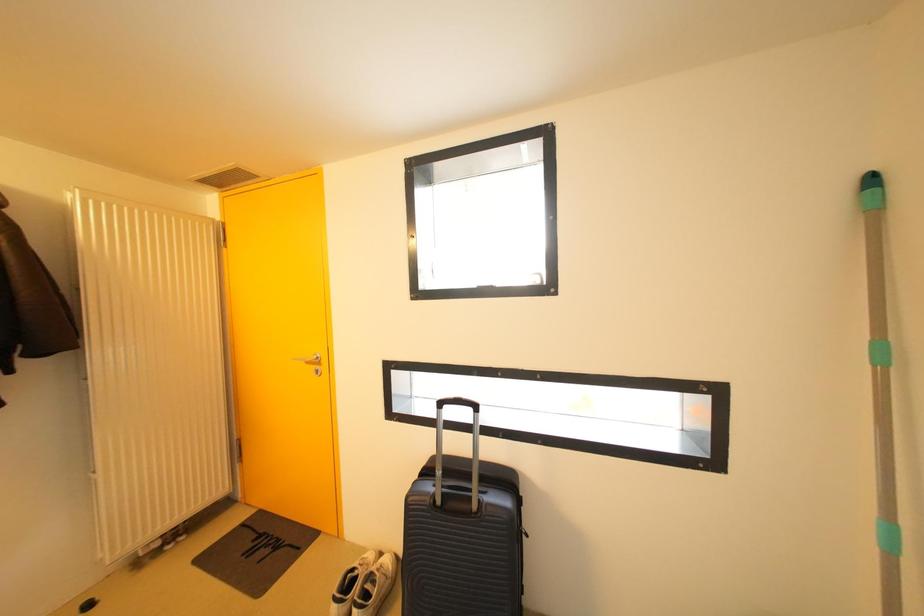
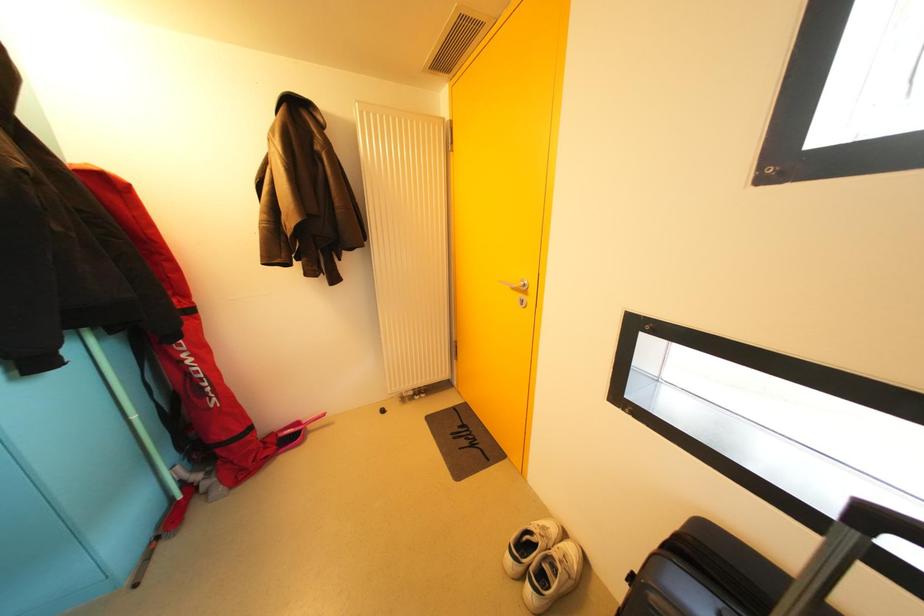
First-person continuous shooting, in which direction is the camera rotating?

The camera's rotation is toward left-down.